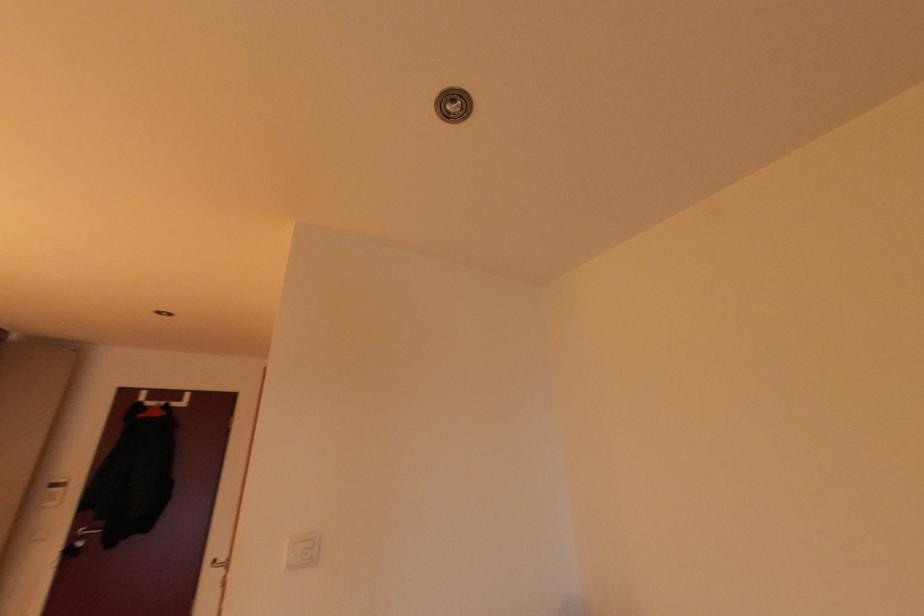
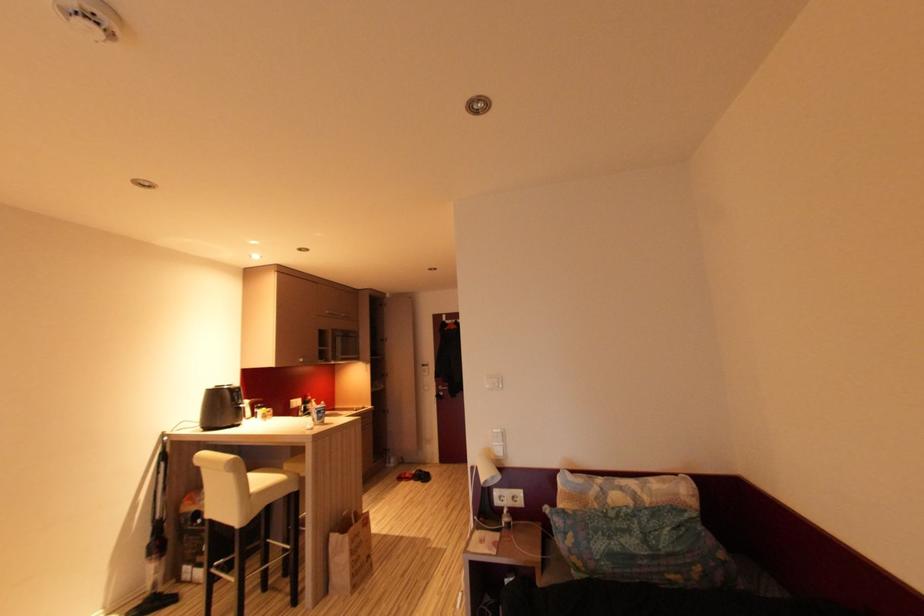
Question: Based on the continuous images, in which direction is the camera rotating? Reply with the corresponding letter.

Choices:
 (A) Left
 (B) Right
 (C) Up
 (D) Down

Answer: (A)